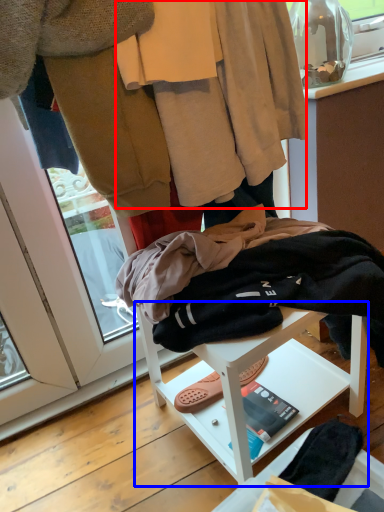
Question: Among these objects, which one is farthest to the camera, robe (highlighted by a red box) or furniture (highlighted by a blue box)?

Choices:
 (A) robe
 (B) furniture

Answer: (A)